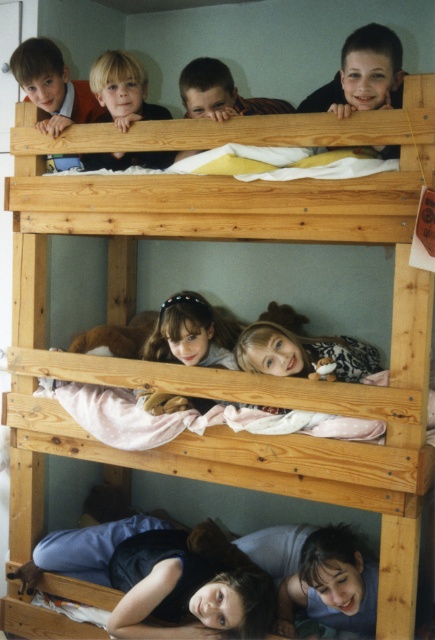
Question: Can you confirm if dark blue fabric at lower center is positioned below blonde hair at upper left?

Choices:
 (A) yes
 (B) no

Answer: (A)

Question: Can you confirm if light brown hairband at center is thinner than blonde hair at upper left?

Choices:
 (A) yes
 (B) no

Answer: (B)

Question: Observing the image, what is the correct spatial positioning of dark blue fabric at lower center in reference to light brown hairband at center?

Choices:
 (A) below
 (B) above

Answer: (A)

Question: Which point is closer to the camera?

Choices:
 (A) (177, 326)
 (B) (100, 83)
 (C) (131, 625)

Answer: (C)

Question: Which object appears farthest from the camera in this image?

Choices:
 (A) dark blue fabric at lower center
 (B) light brown hairband at center

Answer: (B)

Question: Which point is closer to the camera taking this photo?

Choices:
 (A) (176, 304)
 (B) (127, 51)

Answer: (A)